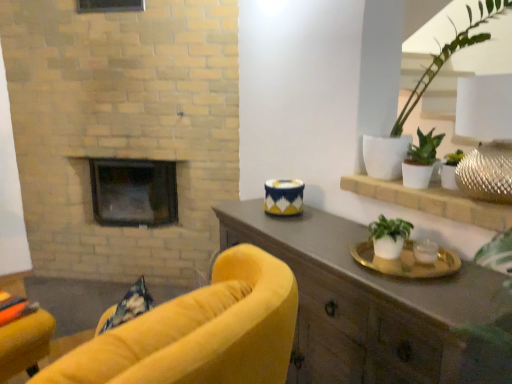
Identify the location of free space in front of white matte plant pot at right, arranged as the second houseplant when viewed from the top. (441, 196).